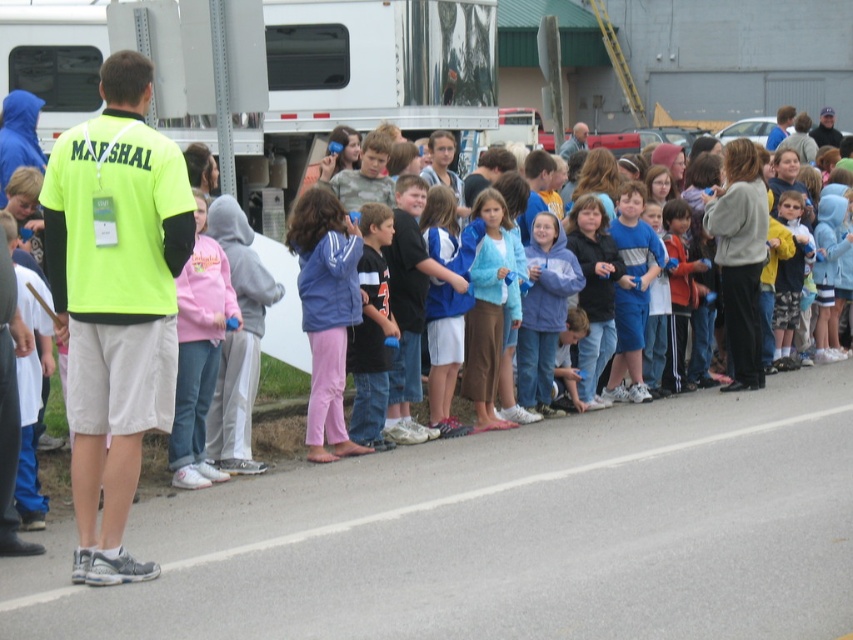
Question: Which object appears closest to the camera in this image?

Choices:
 (A) pink fleece jacket at center
 (B) silver metallic trailer truck at center
 (C) neon yellow shirt at left
 (D) smooth asphalt road at lower center

Answer: (D)

Question: Is silver metallic trailer truck at center bigger than pink fleece jacket at center?

Choices:
 (A) no
 (B) yes

Answer: (A)

Question: Is silver metallic trailer truck at center behind pink fleece jacket at center?

Choices:
 (A) yes
 (B) no

Answer: (A)

Question: Which point is farther to the camera?

Choices:
 (A) smooth asphalt road at lower center
 (B) pink fleece jacket at center

Answer: (B)

Question: Does neon yellow shirt at left appear on the left side of pink fleece jacket at center?

Choices:
 (A) yes
 (B) no

Answer: (A)

Question: Which is nearer to the smooth asphalt road at lower center?

Choices:
 (A) neon yellow shirt at left
 (B) pink fleece jacket at center
 (C) silver metallic trailer truck at center

Answer: (A)